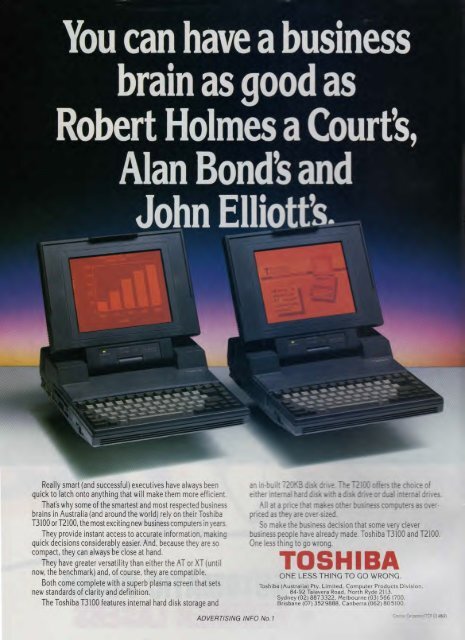
Find the location of a particular element. The width and height of the screenshot is (465, 640). two computer keyboards is located at coordinates (331, 396), (145, 406).